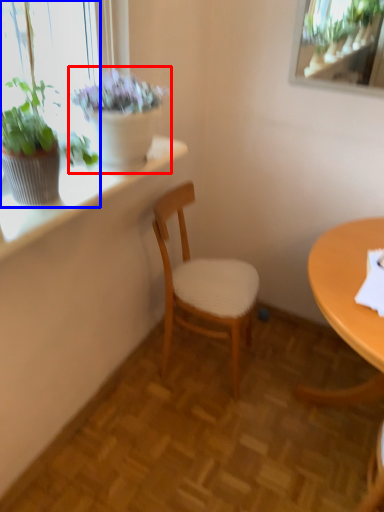
Question: Which object appears closest to the camera in this image, houseplant (highlighted by a red box) or houseplant (highlighted by a blue box)?

Choices:
 (A) houseplant
 (B) houseplant

Answer: (B)